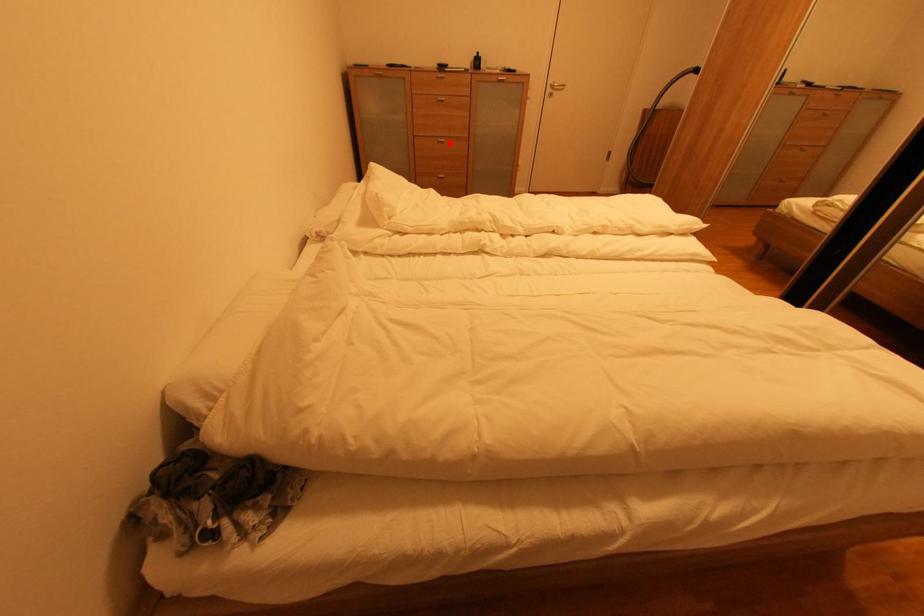
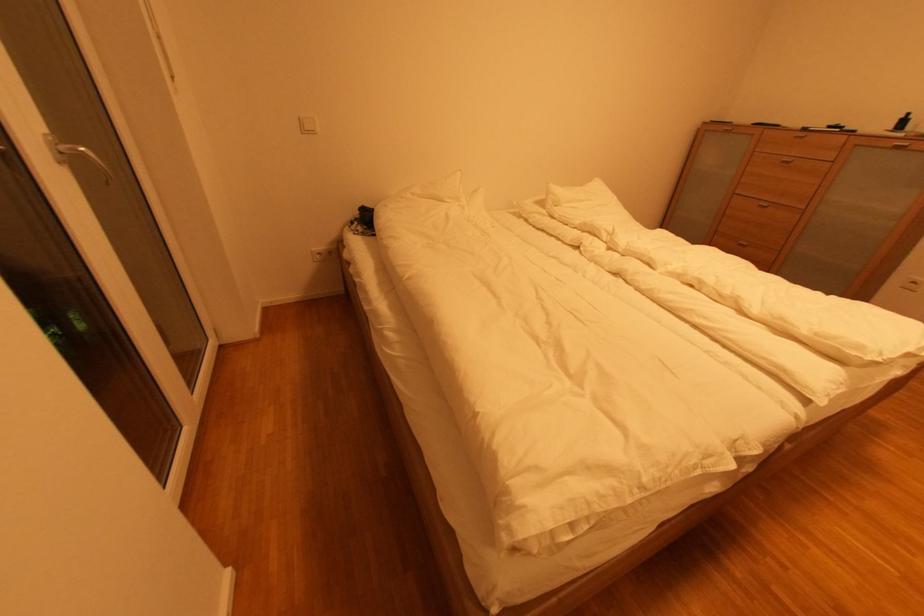
Locate, in the second image, the point that corresponds to the highlighted location in the first image.

(772, 208)